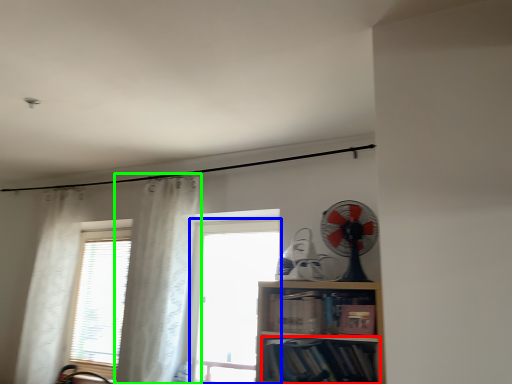
Question: Estimate the real-world distances between objects in this image. Which object is closer to book (highlighted by a red box), window (highlighted by a blue box) or curtain (highlighted by a green box)?

Choices:
 (A) window
 (B) curtain

Answer: (B)